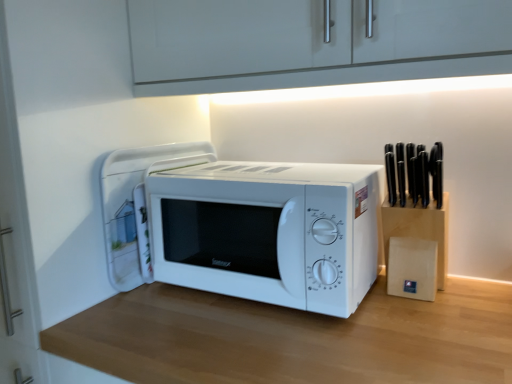
Question: Is white glossy microwave at center thinner than wooden table at center?

Choices:
 (A) no
 (B) yes

Answer: (B)

Question: Would you consider white glossy microwave at center to be distant from wooden table at center?

Choices:
 (A) yes
 (B) no

Answer: (B)

Question: Is the surface of white glossy microwave at center in direct contact with wooden table at center?

Choices:
 (A) no
 (B) yes

Answer: (A)

Question: From the image's perspective, would you say white glossy microwave at center is positioned over wooden table at center?

Choices:
 (A) no
 (B) yes

Answer: (B)

Question: Does white glossy microwave at center lie behind wooden table at center?

Choices:
 (A) yes
 (B) no

Answer: (A)

Question: In terms of width, does white glossy microwave at center look wider or thinner when compared to wooden table at center?

Choices:
 (A) thin
 (B) wide

Answer: (A)

Question: Is white glossy microwave at center in front of or behind wooden table at center in the image?

Choices:
 (A) behind
 (B) front

Answer: (A)

Question: Visually, is white glossy microwave at center positioned to the left or to the right of wooden table at center?

Choices:
 (A) right
 (B) left

Answer: (B)

Question: Is white glossy microwave at center inside or outside of wooden table at center?

Choices:
 (A) outside
 (B) inside

Answer: (A)

Question: Does point tap(102, 211) appear closer or farther from the camera than point tap(344, 309)?

Choices:
 (A) closer
 (B) farther

Answer: (B)

Question: Is white glossy microwave at center wider or thinner than white matte microwave at center?

Choices:
 (A) thin
 (B) wide

Answer: (B)

Question: Would you say white glossy microwave at center is to the left or to the right of white matte microwave at center in the picture?

Choices:
 (A) left
 (B) right

Answer: (A)

Question: Would you say white glossy microwave at center is inside or outside white matte microwave at center?

Choices:
 (A) inside
 (B) outside

Answer: (B)

Question: Considering the positions of white matte microwave at center and wooden table at center in the image, is white matte microwave at center taller or shorter than wooden table at center?

Choices:
 (A) short
 (B) tall

Answer: (A)

Question: Is white matte microwave at center in front of or behind wooden table at center in the image?

Choices:
 (A) front
 (B) behind

Answer: (B)